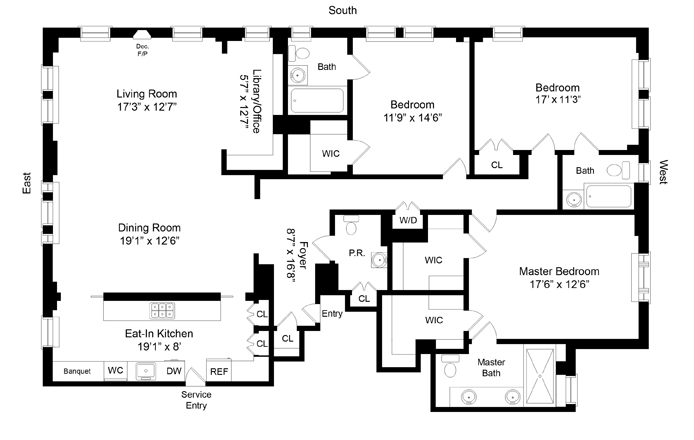
Locate an element on the screen. This screenshot has height=440, width=694. 2nd wc is located at coordinates (431, 265).